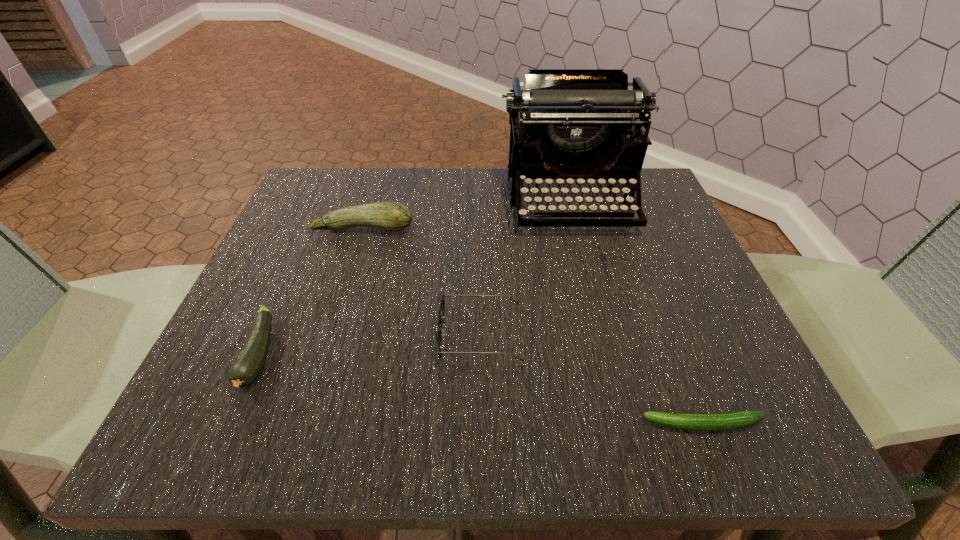
You are a GUI agent. You are given a task and a screenshot of the screen. Output one action in this format:
    pyautogui.click(x=<x>, y=<y>)
    Task: Click on the free spot located 0.250m through the lenses of the spectacles
    
    Given the screenshot: What is the action you would take?
    pyautogui.click(x=287, y=336)

The image size is (960, 540). I want to click on vacant area located 0.150m through the lenses of the spectacles, so click(x=348, y=336).

Identify the location of blank area located 0.350m on the front-facing side of the nearest zucchini. (391, 424).

The image size is (960, 540). I want to click on blank space located 0.270m on the front-facing side of the nearest zucchini, so click(448, 424).

Find the location of `free space located on the front-facing side of the nearest zucchini`. free space located on the front-facing side of the nearest zucchini is located at coordinates (456, 424).

The height and width of the screenshot is (540, 960). In order to click on typewriter at the far edge in this screenshot , I will do `click(580, 124)`.

This screenshot has height=540, width=960. Find the location of `zucchini that is at the far edge`. zucchini that is at the far edge is located at coordinates 391,216.

Find the location of a particular element. The image size is (960, 540). typewriter located in the right edge section of the desktop is located at coordinates (580, 124).

Find the location of a particular element. zucchini that is at the right edge is located at coordinates (729, 421).

Locate an element on the screen. The height and width of the screenshot is (540, 960). object that is at the far left corner is located at coordinates (391, 216).